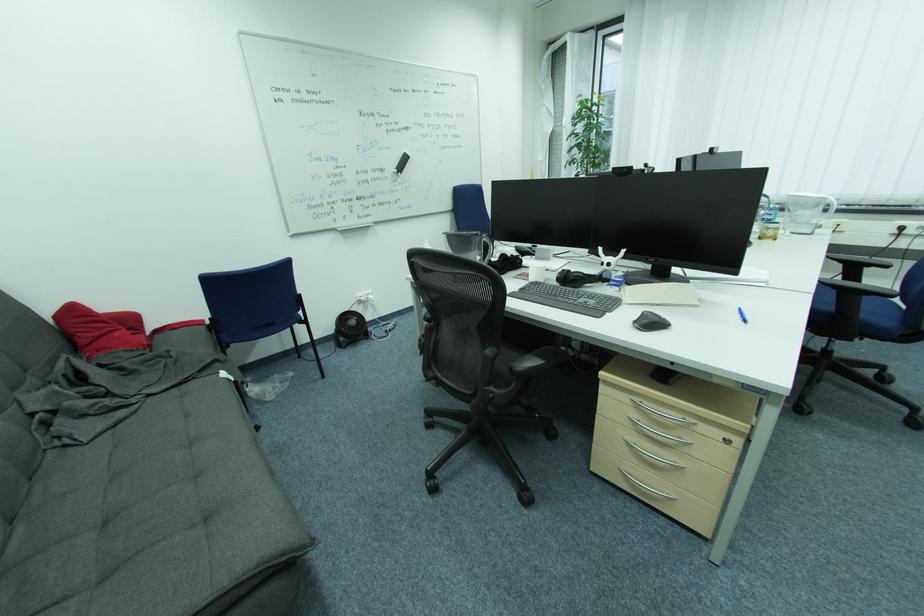
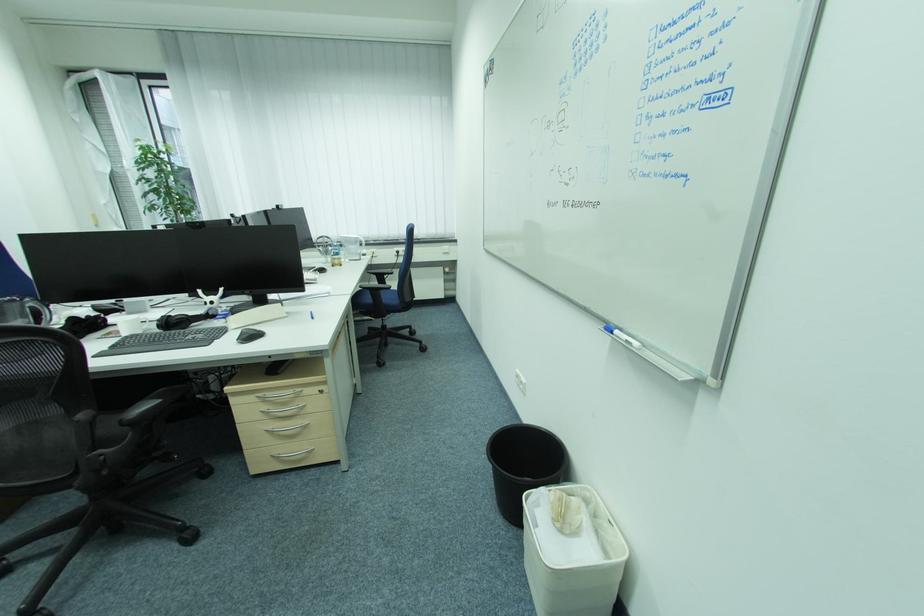
The point at (651, 322) is marked in the first image. Where is the corresponding point in the second image?

(251, 338)